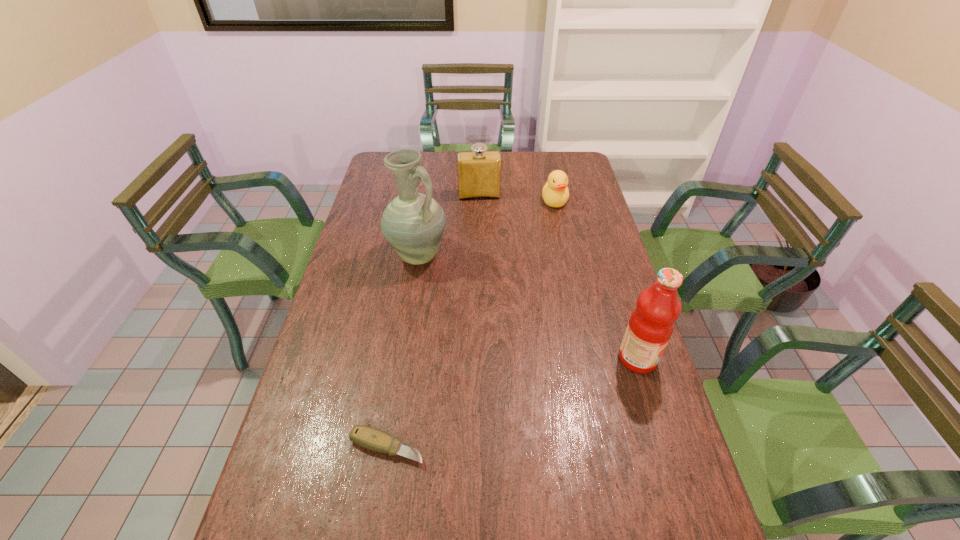
You are a GUI agent. You are given a task and a screenshot of the screen. Output one action in this format:
    pyautogui.click(x=<x>, y=<y>)
    Task: Click on the free space that is in between the nearest object and the pitcher
    Image resolution: width=960 pixels, height=540 pixels.
    Given the screenshot: What is the action you would take?
    pyautogui.click(x=402, y=352)

Where is `vacant space that's between the rightmost object and the shortest object`? The image size is (960, 540). vacant space that's between the rightmost object and the shortest object is located at coordinates (513, 403).

Locate an element on the screen. The height and width of the screenshot is (540, 960). empty space between the second tallest object and the nearest object is located at coordinates (513, 403).

You are a GUI agent. You are given a task and a screenshot of the screen. Output one action in this format:
    pyautogui.click(x=<x>, y=<y>)
    Task: Click on the free spot between the perfume and the fourth object from left to right
    The width and height of the screenshot is (960, 540).
    Given the screenshot: What is the action you would take?
    pyautogui.click(x=517, y=198)

I want to click on vacant space that is in between the second shortest object and the pocketknife, so click(471, 324).

The width and height of the screenshot is (960, 540). Identify the location of vacant region between the fourth tallest object and the pocketknife. (471, 324).

I want to click on free spot between the rightmost object and the third object from left to right, so click(x=559, y=277).

Where is `free space between the perfume and the pitcher`? free space between the perfume and the pitcher is located at coordinates (448, 225).

This screenshot has height=540, width=960. Find the location of `free space between the tallest object and the nearest object`. free space between the tallest object and the nearest object is located at coordinates tap(402, 352).

The height and width of the screenshot is (540, 960). What are the coordinates of `free space between the third tallest object and the tallest object` in the screenshot? It's located at (448, 225).